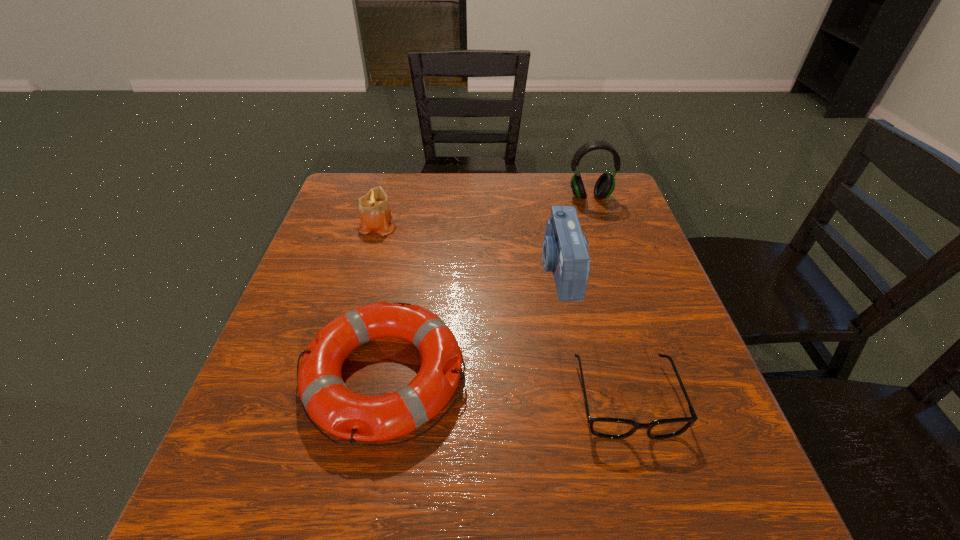
Image resolution: width=960 pixels, height=540 pixels. Identify the location of object present at the far right corner. (605, 185).

Where is `vacant space at the far edge of the desktop`? The width and height of the screenshot is (960, 540). vacant space at the far edge of the desktop is located at coordinates pyautogui.click(x=419, y=197).

You are a GUI agent. You are given a task and a screenshot of the screen. Output one action in this format:
    pyautogui.click(x=<x>, y=<y>)
    Task: Click on the free space at the near edge of the desktop
    Image resolution: width=960 pixels, height=540 pixels.
    Given the screenshot: What is the action you would take?
    coord(439,526)

Image resolution: width=960 pixels, height=540 pixels. What are the coordinates of `free space at the left edge` in the screenshot? It's located at (277, 469).

Locate an element on the screen. The width and height of the screenshot is (960, 540). free space at the right edge is located at coordinates (649, 448).

You are a GUI agent. You are given a task and a screenshot of the screen. Output one action in this format:
    pyautogui.click(x=<x>, y=<y>)
    Task: Click on the vacant space at the far right corner of the desktop
    
    Given the screenshot: What is the action you would take?
    pyautogui.click(x=619, y=182)

At what (x,y) coordinates should I click in order to perform the action: click on vacant area that lies between the life buoy and the candle. Please return your answer as a coordinate pair (x, y). The image size is (960, 540). Looking at the image, I should click on (381, 300).

Image resolution: width=960 pixels, height=540 pixels. Find the location of `unoccupied area between the life buoy and the farthest object`. unoccupied area between the life buoy and the farthest object is located at coordinates (487, 287).

This screenshot has height=540, width=960. I want to click on free space between the fourth tallest object and the spectacles, so click(505, 387).

Find the location of `free space between the farthest object and the second shortest object`. free space between the farthest object and the second shortest object is located at coordinates pos(487,287).